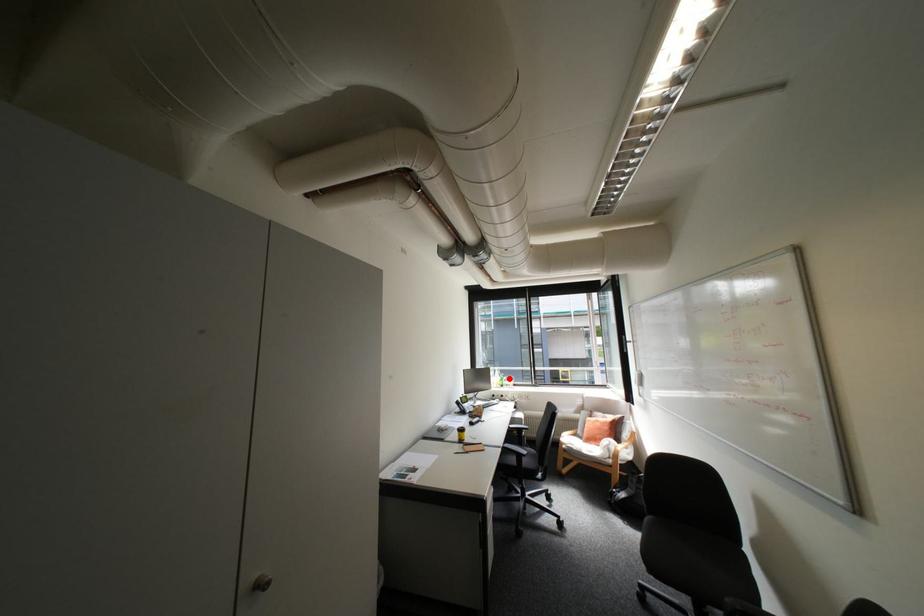
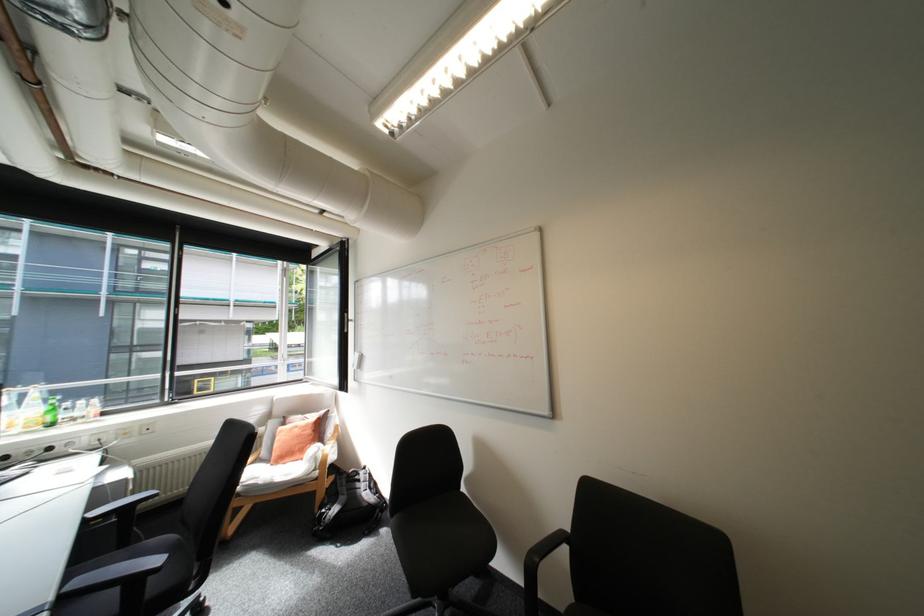
Question: I am providing you with two images of the same scene from different viewpoints. A red point is marked on the first image. Can you still see the location of the red point in image 2?

Choices:
 (A) Yes
 (B) No

Answer: (A)